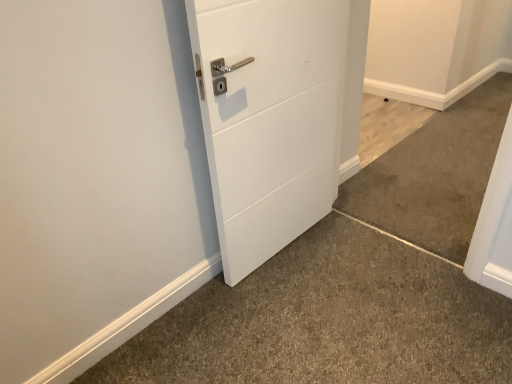
Question: Considering the relative sizes of white matte door at center and gray carpet at lower left, placed as the 1th concrete when sorted from bottom to top, in the image provided, is white matte door at center wider than gray carpet at lower left, placed as the 1th concrete when sorted from bottom to top,?

Choices:
 (A) no
 (B) yes

Answer: (A)

Question: Is white matte door at center completely or partially outside of gray carpet at lower left, placed as the 1th concrete when sorted from bottom to top?

Choices:
 (A) no
 (B) yes

Answer: (B)

Question: Does white matte door at center have a larger size compared to gray carpet at lower left, placed as the 1th concrete when sorted from bottom to top?

Choices:
 (A) no
 (B) yes

Answer: (B)

Question: From the image's perspective, is white matte door at center located above gray carpet at lower left, positioned as the third concrete in top-to-bottom order?

Choices:
 (A) no
 (B) yes

Answer: (B)

Question: Could you tell me if white matte door at center is turned towards gray carpet at lower left, positioned as the third concrete in top-to-bottom order?

Choices:
 (A) yes
 (B) no

Answer: (A)

Question: Does white matte door at center have a greater height compared to gray carpet at lower left, positioned as the third concrete in top-to-bottom order?

Choices:
 (A) yes
 (B) no

Answer: (A)

Question: From the image's perspective, is light brown wood floor at lower right, positioned as the 3th concrete in bottom-to-top order, below gray carpet at lower left, positioned as the third concrete in top-to-bottom order?

Choices:
 (A) yes
 (B) no

Answer: (B)

Question: Can you confirm if light brown wood floor at lower right, positioned as the 3th concrete in bottom-to-top order, is positioned to the left of gray carpet at lower left, positioned as the third concrete in top-to-bottom order?

Choices:
 (A) yes
 (B) no

Answer: (B)

Question: Could gray carpet at lower left, positioned as the third concrete in top-to-bottom order, be considered to be inside light brown wood floor at lower right, positioned as the 3th concrete in bottom-to-top order?

Choices:
 (A) yes
 (B) no

Answer: (B)

Question: Is light brown wood floor at lower right, positioned as the first concrete in top-to-bottom order, oriented away from gray carpet at lower left, placed as the 1th concrete when sorted from bottom to top?

Choices:
 (A) yes
 (B) no

Answer: (B)

Question: Could you tell me if light brown wood floor at lower right, positioned as the first concrete in top-to-bottom order, is turned towards gray carpet at lower left, positioned as the third concrete in top-to-bottom order?

Choices:
 (A) no
 (B) yes

Answer: (A)

Question: Considering the relative sizes of light brown wood floor at lower right, positioned as the 3th concrete in bottom-to-top order, and gray carpet at lower left, positioned as the third concrete in top-to-bottom order, in the image provided, is light brown wood floor at lower right, positioned as the 3th concrete in bottom-to-top order, shorter than gray carpet at lower left, positioned as the third concrete in top-to-bottom order,?

Choices:
 (A) no
 (B) yes

Answer: (A)

Question: Is light brown wood floor at lower right, positioned as the 3th concrete in bottom-to-top order, surrounding white matte door at center?

Choices:
 (A) yes
 (B) no

Answer: (B)